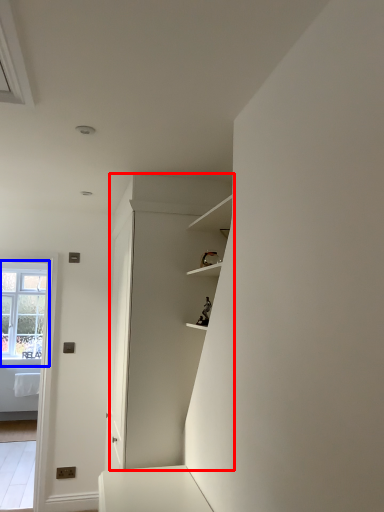
Question: Which point is closer to the camera, dresser (highlighted by a red box) or window (highlighted by a blue box)?

Choices:
 (A) dresser
 (B) window

Answer: (A)